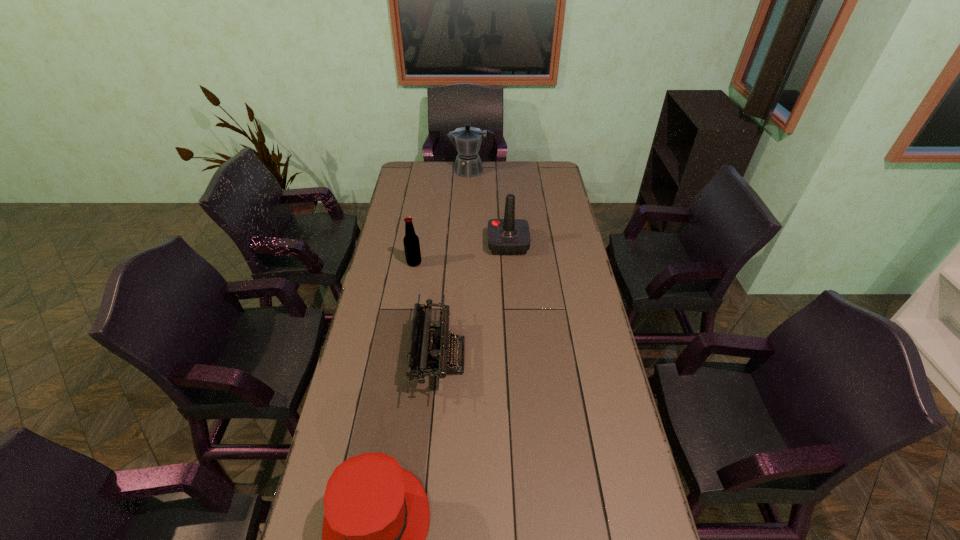
This screenshot has width=960, height=540. Find the location of `the farthest object`. the farthest object is located at coordinates (467, 140).

Find the location of `joystick`. joystick is located at coordinates (509, 236).

You are a GUI agent. You are given a task and a screenshot of the screen. Output one action in this format:
    pyautogui.click(x=<x>, y=<y>)
    Task: Click on the beer bottle
    
    Given the screenshot: What is the action you would take?
    pyautogui.click(x=411, y=241)

You are a GUI agent. You are given a task and a screenshot of the screen. Output one action in this format:
    pyautogui.click(x=<x>, y=<y>)
    Task: Click on the typewriter
    This screenshot has width=960, height=540.
    Given the screenshot: What is the action you would take?
    pyautogui.click(x=429, y=353)

Locate an element on the screen. The height and width of the screenshot is (540, 960). the fourth farthest object is located at coordinates (429, 353).

I want to click on free location located at the spout of the coffeepot, so click(x=405, y=171).

This screenshot has height=540, width=960. In order to click on vacant position located at the spout of the coffeepot in this screenshot , I will do `click(426, 171)`.

Find the location of a particular element. free space located at the spout of the coffeepot is located at coordinates 419,171.

This screenshot has height=540, width=960. Identify the location of vacant space located 0.050m on the front of the joystick. (510, 266).

Locate an element on the screen. The image size is (960, 540). vacant region located 0.330m on the back of the third nearest object is located at coordinates (422, 211).